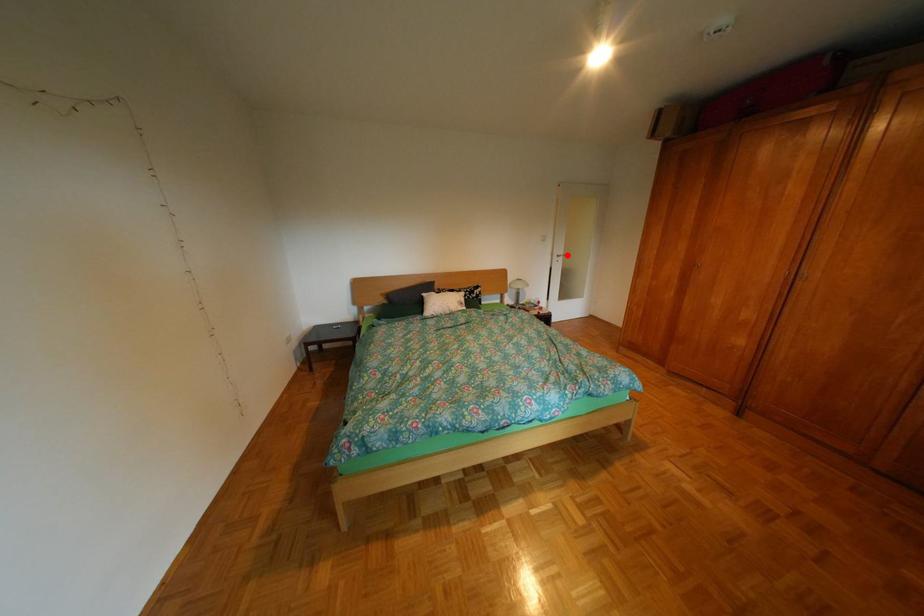
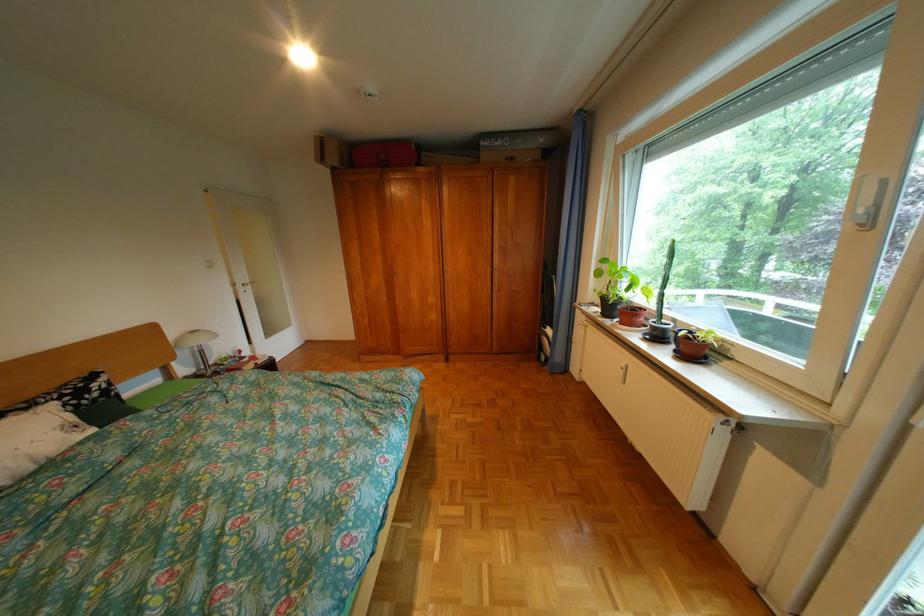
Question: A red point is marked in image1. In image2, is the corresponding 3D point closer to the camera or farther? Reply with the corresponding letter.

Choices:
 (A) The corresponding 3D point is closer.
 (B) The corresponding 3D point is farther.

Answer: (B)